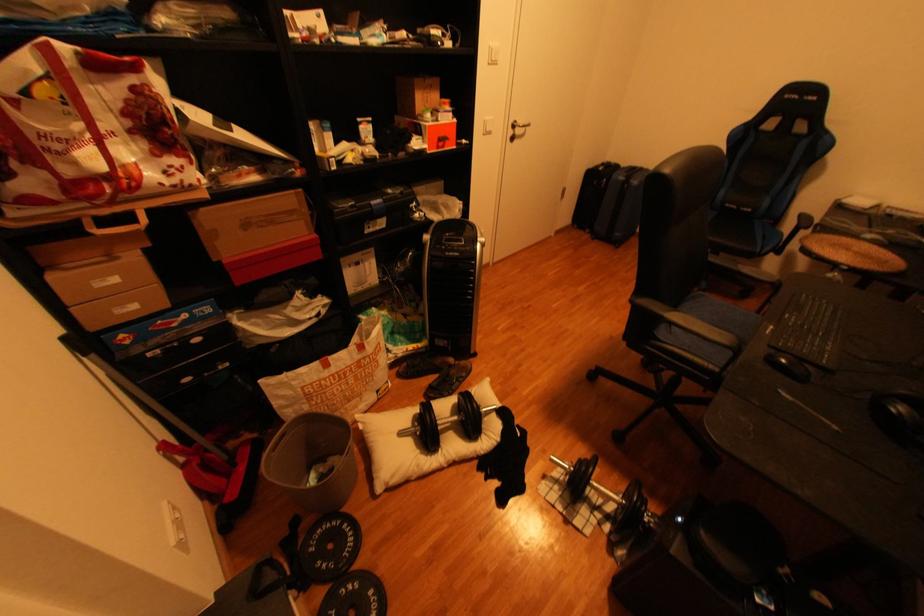
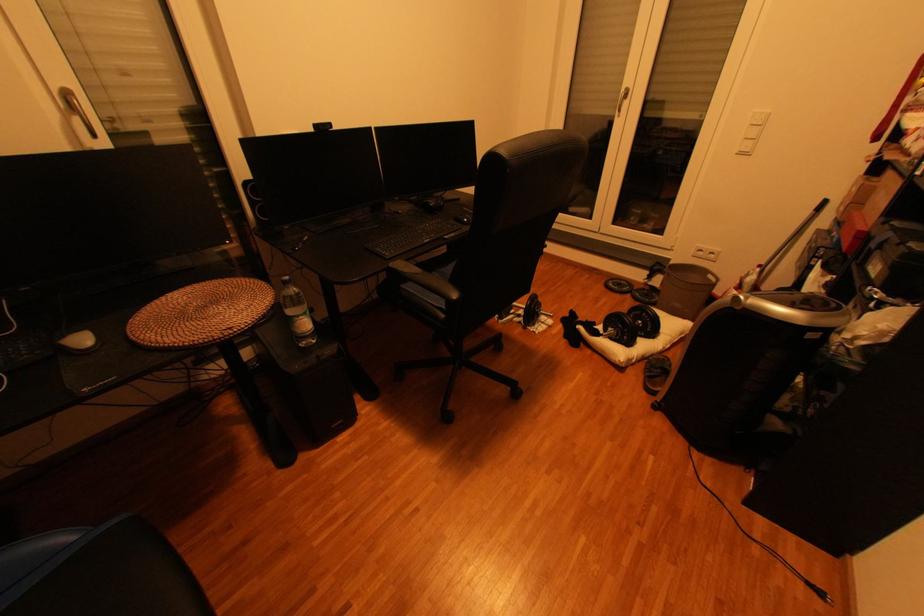
Where in the second image is the point corresponding to point 548,484 from the first image?

(564, 323)